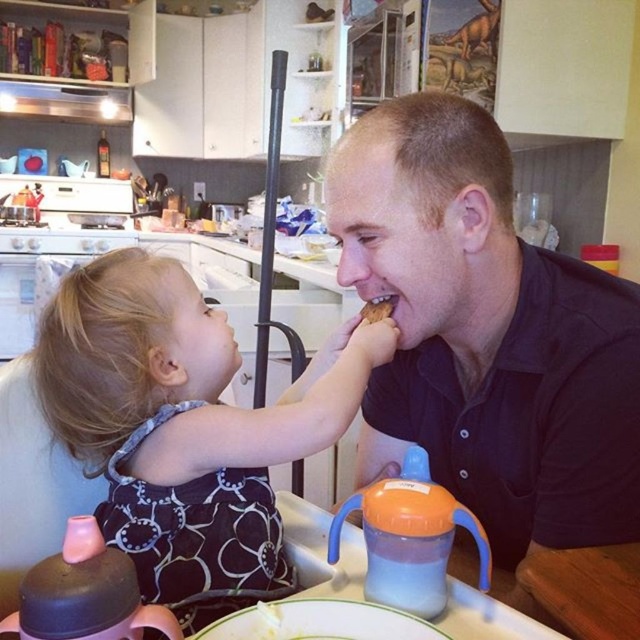
Can you confirm if black matte shirt at center is smaller than brown crumbly bread at mouth?

No, black matte shirt at center is not smaller than brown crumbly bread at mouth.

Is black matte shirt at center positioned behind brown crumbly bread at mouth?

No, it is not.

Who is more distant from viewer, (x=548, y=301) or (x=378, y=307)?

Point (x=378, y=307)

I want to click on black matte shirt at center, so click(x=484, y=333).

Who is lower down, matte black dress at center or brown crumbly bread at mouth?

matte black dress at center is lower down.

Is matte black dress at center taller than brown crumbly bread at mouth?

Correct, matte black dress at center is much taller as brown crumbly bread at mouth.

Locate an element on the screen. matte black dress at center is located at coordinates (184, 428).

Where is `matte black dress at center`? matte black dress at center is located at coordinates (184, 428).

Is black matte shirt at center thinner than matte black dress at center?

Indeed, black matte shirt at center has a lesser width compared to matte black dress at center.

Does black matte shirt at center appear under matte black dress at center?

Incorrect, black matte shirt at center is not positioned below matte black dress at center.

Identify the location of black matte shirt at center. This screenshot has height=640, width=640. (484, 333).